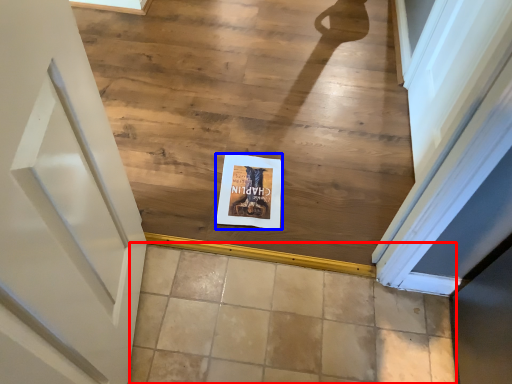
Question: Among these objects, which one is farthest to the camera, tile (highlighted by a red box) or postcard (highlighted by a blue box)?

Choices:
 (A) tile
 (B) postcard

Answer: (B)